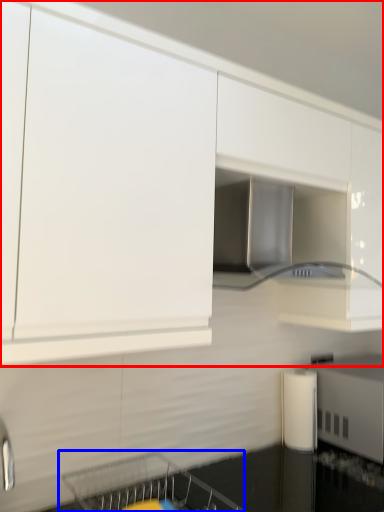
Question: Which of the following is the closest to the observer, cabinetry (highlighted by a red box) or dish washer (highlighted by a blue box)?

Choices:
 (A) cabinetry
 (B) dish washer

Answer: (A)